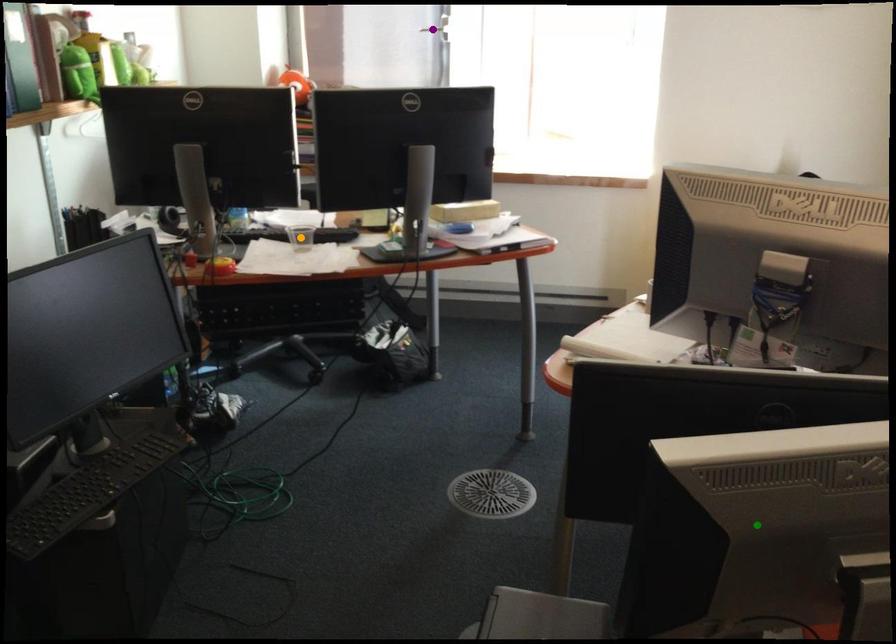
Order these from nearest to farthest:
orange point | green point | purple point

green point < orange point < purple point